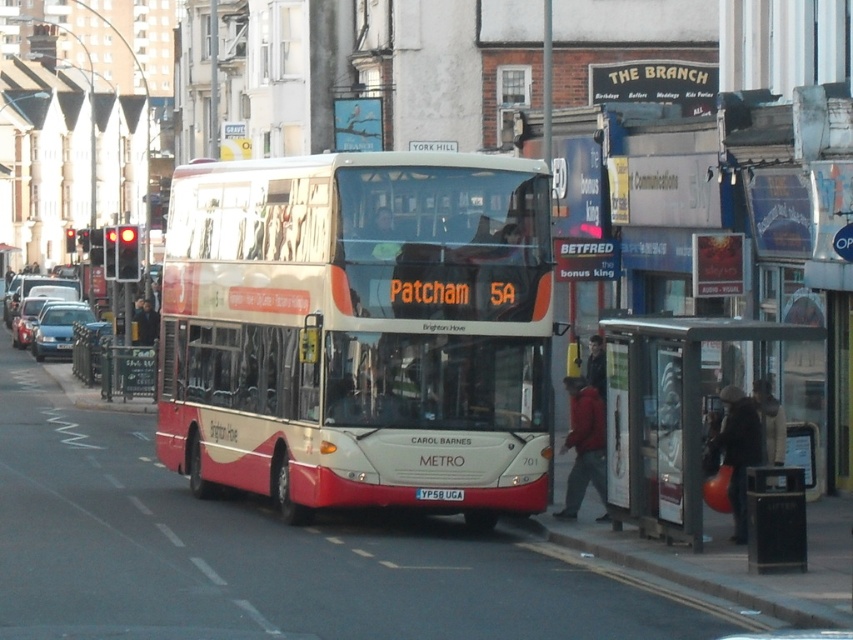
Does metallic bus stop at lower right have a smaller size compared to matte blue sedan at left?

Indeed, metallic bus stop at lower right has a smaller size compared to matte blue sedan at left.

You are a GUI agent. You are given a task and a screenshot of the screen. Output one action in this format:
    pyautogui.click(x=<x>, y=<y>)
    Task: Click on the metallic bus stop at lower right
    The image size is (853, 640).
    Given the screenshot: What is the action you would take?
    pyautogui.click(x=689, y=404)

Which is behind, point (219, 339) or point (625, 328)?

Point (219, 339)

Describe the element at coordinates (358, 330) in the screenshot. I see `white glossy bus at center` at that location.

Where is `white glossy bus at center`? white glossy bus at center is located at coordinates (358, 330).

Based on the photo, can you confirm if matte blue sedan at left is positioned to the left of metallic silver car at center-left?

Incorrect, matte blue sedan at left is not on the left side of metallic silver car at center-left.

Can you confirm if matte blue sedan at left is positioned below metallic silver car at center-left?

Correct, matte blue sedan at left is located below metallic silver car at center-left.

Which is behind, point (57, 307) or point (38, 304)?

The point (38, 304) is more distant.

The image size is (853, 640). Identify the location of matte blue sedan at left. (57, 328).